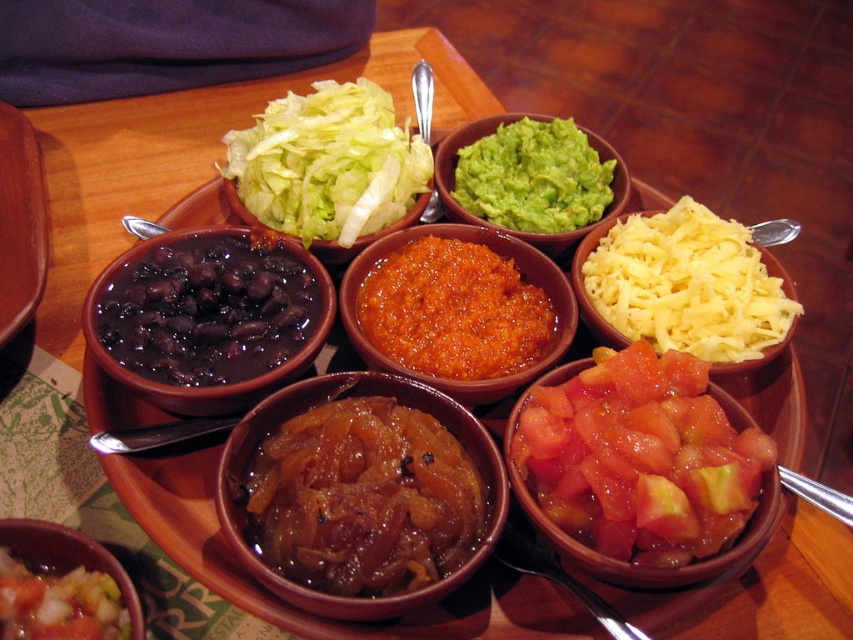
Who is more forward, [113,355] or [569,148]?

Point [113,355] is in front.

Which is more to the right, matte black beans at left or green smooth guacamole at center right?

Positioned to the right is green smooth guacamole at center right.

Which is in front, point (138, 337) or point (573, 211)?

Positioned in front is point (138, 337).

Identify the location of matte black beans at left. This screenshot has width=853, height=640. (207, 317).

How distant is orange textured salsa at center from green smooth guacamole at center right?

orange textured salsa at center and green smooth guacamole at center right are 7.03 inches apart.

Is point (480, 396) farther from viewer compared to point (518, 157)?

No, (480, 396) is closer to viewer.

Is point (552, 291) closer to camera compared to point (556, 156)?

Yes, it is.

Where is `orange textured salsa at center`? The width and height of the screenshot is (853, 640). orange textured salsa at center is located at coordinates (454, 312).

Does shiny brown bowl at center have a larger size compared to yellow shredded cheese at center right?

Actually, shiny brown bowl at center might be smaller than yellow shredded cheese at center right.

Who is more forward, (293, 464) or (743, 269)?

Point (293, 464)

Is point (345, 609) behind point (744, 246)?

No.

This screenshot has height=640, width=853. What are the coordinates of `shiny brown bowl at center` in the screenshot? It's located at (360, 488).